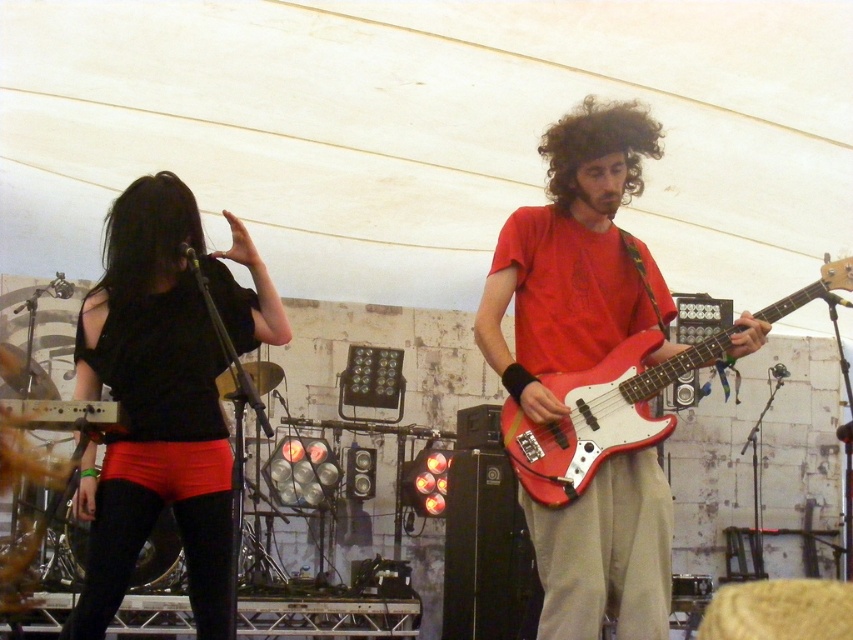
Question: Is matte red guitar at center wider than black matte shirt at left?

Choices:
 (A) yes
 (B) no

Answer: (A)

Question: Which point is farther to the camera?

Choices:
 (A) (764, 316)
 (B) (595, 580)

Answer: (A)

Question: Considering the relative positions of black matte shirt at left and matte red electric guitar at right in the image provided, where is black matte shirt at left located with respect to matte red electric guitar at right?

Choices:
 (A) left
 (B) right

Answer: (A)

Question: Estimate the real-world distances between objects in this image. Which object is farther from the matte red guitar at center?

Choices:
 (A) matte red electric guitar at right
 (B) black matte shirt at left

Answer: (B)

Question: Among these objects, which one is farthest from the camera?

Choices:
 (A) matte red guitar at center
 (B) matte red electric guitar at right

Answer: (A)

Question: Is matte red guitar at center bigger than matte red electric guitar at right?

Choices:
 (A) yes
 (B) no

Answer: (A)